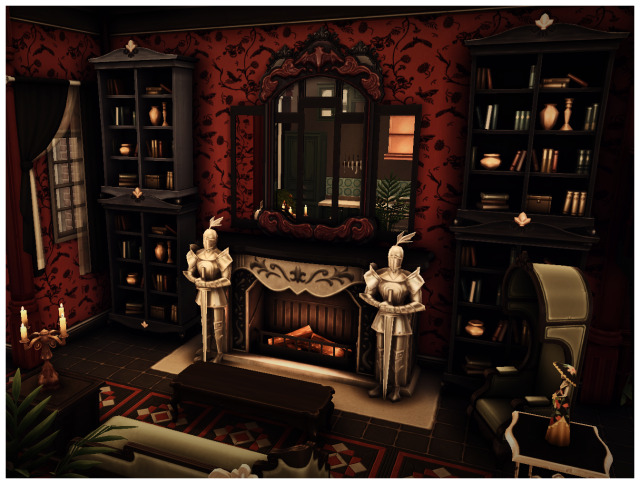
Identify the location of fireplace. This screenshot has width=640, height=484. (304, 319).